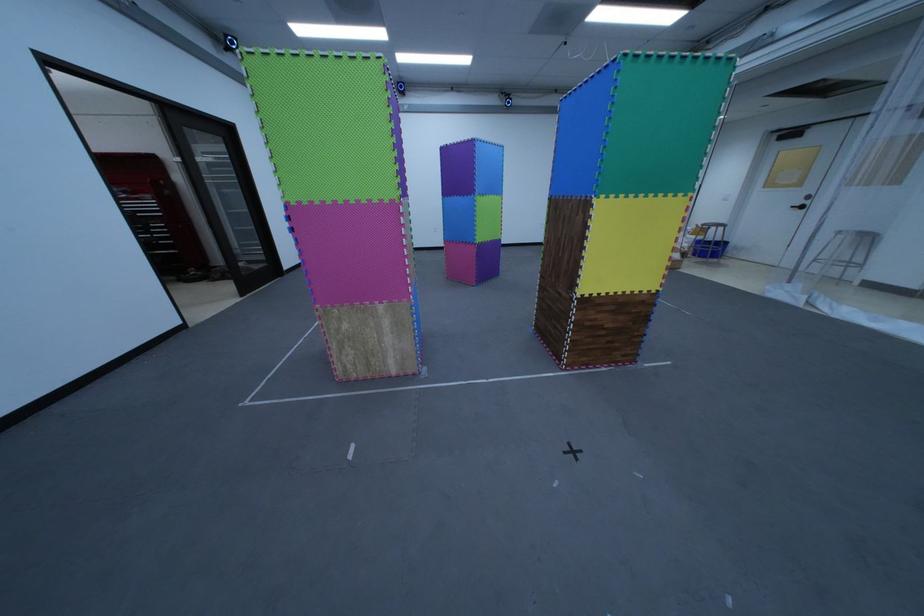
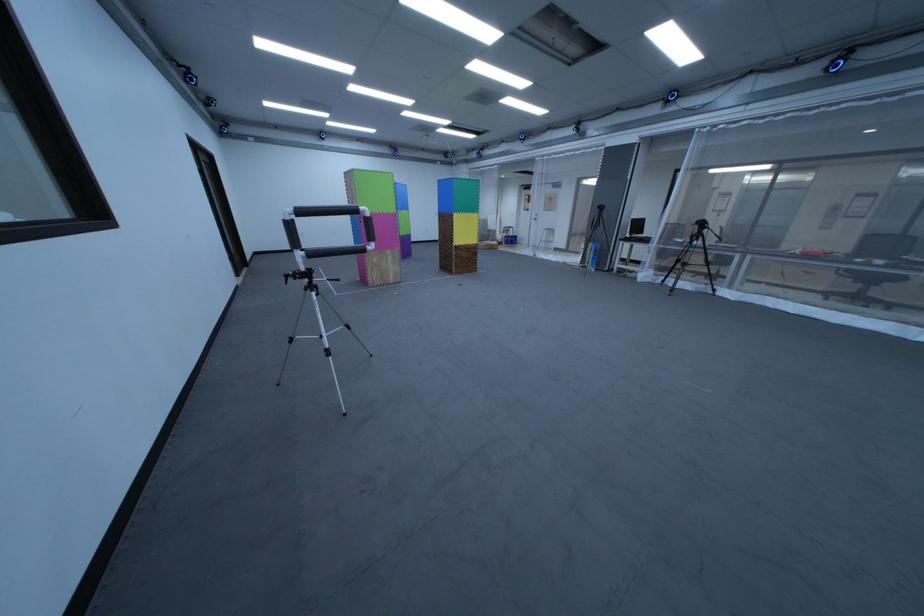
Find the pixel in the second image that matches pixel 611 201 in the first image.

(469, 216)